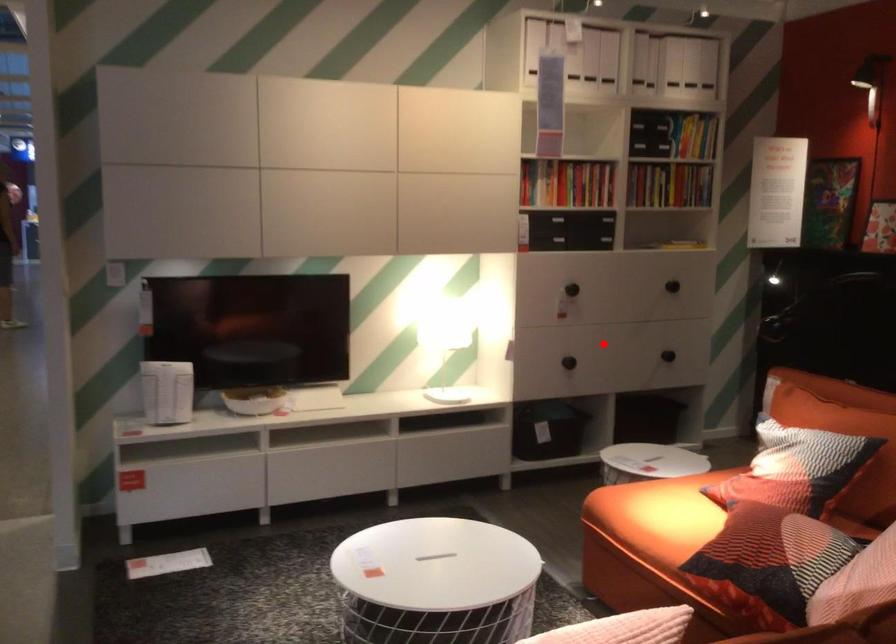
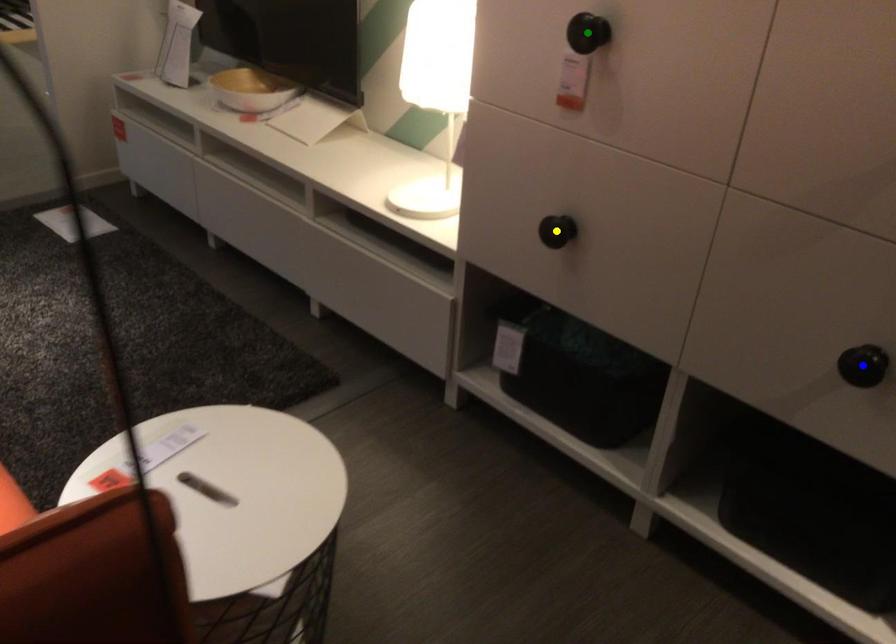
Question: I am providing you with two images of the same scene from different viewpoints. A red point is marked on the first image. You are given multiple points on the second image. Which spot in image 2 lines up with the point in image 1?

Choices:
 (A) blue point
 (B) green point
 (C) yellow point

Answer: (C)